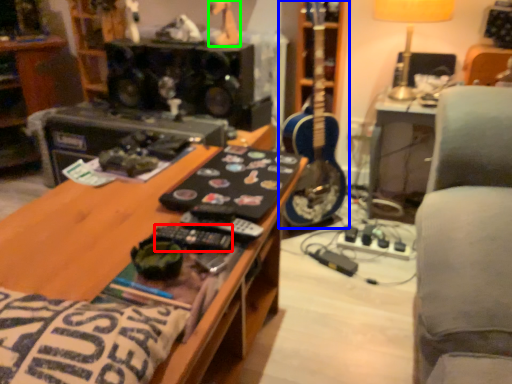
Question: Considering the real-world distances, which object is closest to control (highlighted by a red box)? guitar (highlighted by a blue box) or toy (highlighted by a green box).

Choices:
 (A) guitar
 (B) toy

Answer: (A)